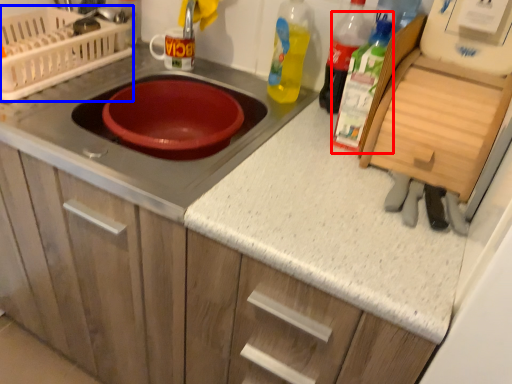
Question: Which point is further to the camera, bottle (highlighted by a red box) or appliance (highlighted by a blue box)?

Choices:
 (A) bottle
 (B) appliance

Answer: (B)